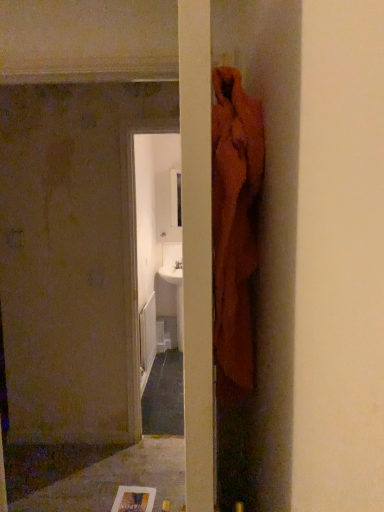
You are a GUI agent. You are given a task and a screenshot of the screen. Output one action in this format:
    pyautogui.click(x=<x>, y=<y>)
    Task: Click on the white glossy sink at center
    This screenshot has width=384, height=512.
    Given the screenshot: What is the action you would take?
    pyautogui.click(x=176, y=296)

Describe the element at coordinates (176, 296) in the screenshot. I see `white glossy sink at center` at that location.

The height and width of the screenshot is (512, 384). Describe the element at coordinates (116, 480) in the screenshot. I see `smooth gray concrete at lower left` at that location.

This screenshot has width=384, height=512. What are the coordinates of `smooth gray concrete at lower left` in the screenshot? It's located at (116, 480).

At what (x,y) coordinates should I click in order to perform the action: click on white glossy sink at center. Please return your answer as a coordinate pair (x, y). The image size is (384, 512). Looking at the image, I should click on (176, 296).

Considering the positions of objects white glossy sink at center and smooth gray concrete at lower left in the image provided, who is more to the left, white glossy sink at center or smooth gray concrete at lower left?

smooth gray concrete at lower left is more to the left.

Is white glossy sink at center in front of or behind smooth gray concrete at lower left in the image?

Clearly, white glossy sink at center is behind smooth gray concrete at lower left.

Is point (182, 326) behind point (162, 455)?

No, (182, 326) is closer to viewer.

From the image's perspective, is white glossy sink at center over smooth gray concrete at lower left?

Yes, from the image's perspective, white glossy sink at center is on top of smooth gray concrete at lower left.

From a real-world perspective, which is physically above, white glossy sink at center or smooth gray concrete at lower left?

white glossy sink at center.

Can you confirm if white glossy sink at center is thinner than smooth gray concrete at lower left?

Yes.

Can you confirm if white glossy sink at center is shorter than smooth gray concrete at lower left?

No, white glossy sink at center is not shorter than smooth gray concrete at lower left.

Considering the sizes of white glossy sink at center and smooth gray concrete at lower left in the image, is white glossy sink at center bigger or smaller than smooth gray concrete at lower left?

Considering their sizes, white glossy sink at center takes up more space than smooth gray concrete at lower left.

Is white glossy sink at center surrounding smooth gray concrete at lower left?

No, smooth gray concrete at lower left is not surrounded by white glossy sink at center.

Is white glossy sink at center not near smooth gray concrete at lower left?

Indeed, white glossy sink at center is not near smooth gray concrete at lower left.

Is white glossy sink at center aimed at smooth gray concrete at lower left?

Yes, white glossy sink at center is oriented towards smooth gray concrete at lower left.

Image resolution: width=384 pixels, height=512 pixels. In order to click on concrete located below the white glossy sink at center (from the image's perspective) in this screenshot , I will do `click(116, 480)`.

Between smooth gray concrete at lower left and white glossy sink at center, which one appears on the right side from the viewer's perspective?

Positioned to the right is white glossy sink at center.

Considering the positions of objects smooth gray concrete at lower left and white glossy sink at center in the image provided, who is in front, smooth gray concrete at lower left or white glossy sink at center?

smooth gray concrete at lower left is in front.

Which is behind, point (101, 476) or point (178, 347)?

Point (178, 347)

From the image's perspective, between smooth gray concrete at lower left and white glossy sink at center, who is located below?

smooth gray concrete at lower left.

From a real-world perspective, is smooth gray concrete at lower left positioned above or below white glossy sink at center?

From a real-world perspective, smooth gray concrete at lower left is physically below white glossy sink at center.

Consider the image. Which of these two, smooth gray concrete at lower left or white glossy sink at center, is thinner?

With smaller width is white glossy sink at center.

Considering the relative sizes of smooth gray concrete at lower left and white glossy sink at center in the image provided, is smooth gray concrete at lower left shorter than white glossy sink at center?

Correct, smooth gray concrete at lower left is not as tall as white glossy sink at center.

Who is bigger, smooth gray concrete at lower left or white glossy sink at center?

Bigger between the two is white glossy sink at center.

Is smooth gray concrete at lower left situated inside white glossy sink at center or outside?

smooth gray concrete at lower left is outside white glossy sink at center.

Would you consider smooth gray concrete at lower left to be distant from white glossy sink at center?

smooth gray concrete at lower left is far away from white glossy sink at center.

Is smooth gray concrete at lower left turned away from white glossy sink at center?

No, smooth gray concrete at lower left is not facing the opposite direction of white glossy sink at center.

Can you tell me how much smooth gray concrete at lower left and white glossy sink at center differ in facing direction?

2.25 degrees.

Locate an element on the screen. This screenshot has width=384, height=512. sink on the right side of smooth gray concrete at lower left is located at coordinates (176, 296).

The image size is (384, 512). I want to click on concrete below the white glossy sink at center (from the image's perspective), so click(x=116, y=480).

Where is `sink above the smooth gray concrete at lower left (from a real-world perspective)`? The width and height of the screenshot is (384, 512). sink above the smooth gray concrete at lower left (from a real-world perspective) is located at coordinates (176, 296).